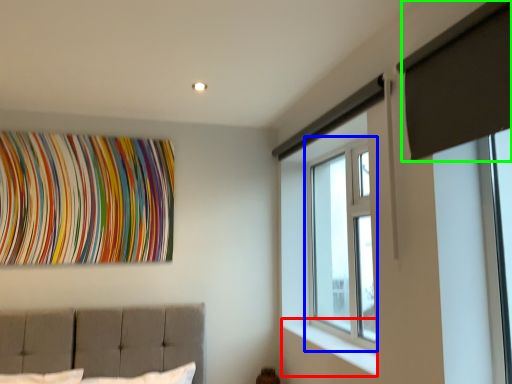
Question: Considering the real-world distances, which object is closest to window sill (highlighted by a red box)? window (highlighted by a blue box) or curtain (highlighted by a green box).

Choices:
 (A) window
 (B) curtain

Answer: (A)